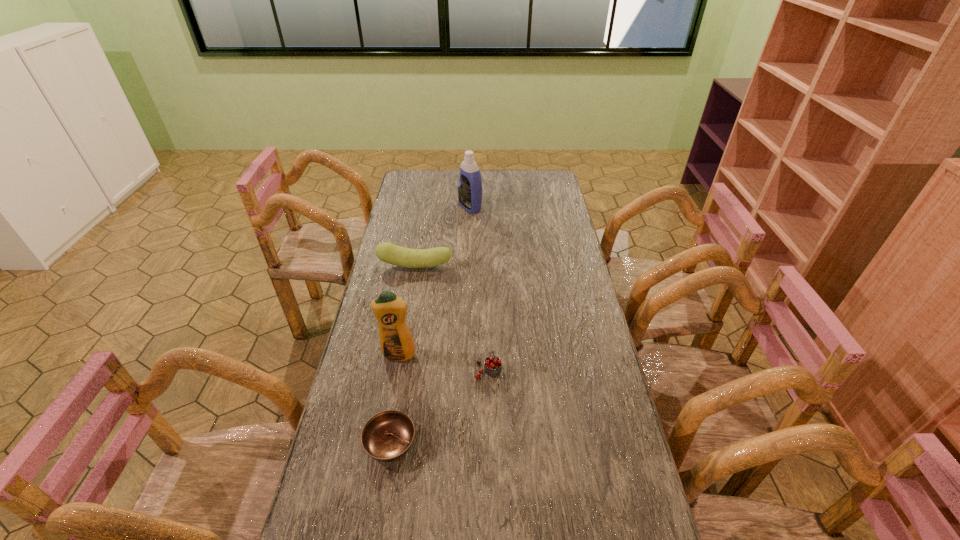
Image resolution: width=960 pixels, height=540 pixels. In the image, there is a desktop. What are the coordinates of `free space at the right edge` in the screenshot? It's located at (549, 274).

Find the location of a particular element. The width and height of the screenshot is (960, 540). vacant space in between the cherry and the farther detergent is located at coordinates (479, 288).

At what (x,y) coordinates should I click in order to perform the action: click on vacant area that lies between the farther detergent and the third tallest object. Please return your answer as a coordinate pair (x, y). This screenshot has height=540, width=960. Looking at the image, I should click on (443, 237).

You are a GUI agent. You are given a task and a screenshot of the screen. Output one action in this format:
    pyautogui.click(x=<x>, y=<y>)
    Task: Click on the unoccupied area between the cherry and the shortest object
    The height and width of the screenshot is (540, 960).
    Given the screenshot: What is the action you would take?
    pyautogui.click(x=440, y=406)

Image resolution: width=960 pixels, height=540 pixels. Find the location of `unoccupied position between the nearest object and the right detergent`. unoccupied position between the nearest object and the right detergent is located at coordinates (430, 325).

I want to click on free space between the left detergent and the right detergent, so click(x=434, y=281).

Locate an element on the screen. unoccupied position between the soup bowl and the farther detergent is located at coordinates (430, 325).

At what (x,y) coordinates should I click in order to perform the action: click on empty location between the cherry and the second farthest object. Please return your answer as a coordinate pair (x, y). Image resolution: width=960 pixels, height=540 pixels. Looking at the image, I should click on (452, 318).

You are a GUI agent. You are given a task and a screenshot of the screen. Output one action in this format:
    pyautogui.click(x=<x>, y=<y>)
    Task: Click on the free spot between the right detergent and the shortest object
    
    Given the screenshot: What is the action you would take?
    pyautogui.click(x=430, y=325)

This screenshot has height=540, width=960. Identify the location of empty location between the second shortest object and the third tallest object. (452, 318).